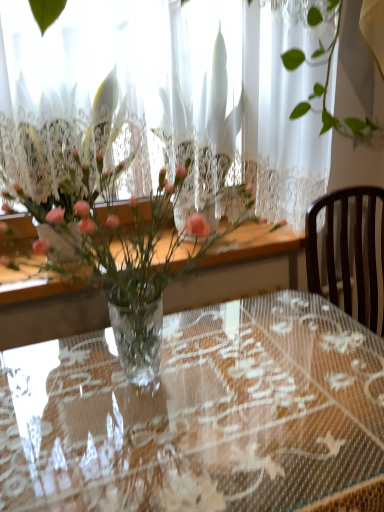
Question: Is translucent glass vase at center smaller than transparent lace tablecloth at center?

Choices:
 (A) no
 (B) yes

Answer: (B)

Question: Is translucent glass vase at center wider than transparent lace tablecloth at center?

Choices:
 (A) yes
 (B) no

Answer: (B)

Question: From the image's perspective, is translucent glass vase at center above transparent lace tablecloth at center?

Choices:
 (A) no
 (B) yes

Answer: (B)

Question: Considering the relative sizes of translucent glass vase at center and transparent lace tablecloth at center in the image provided, is translucent glass vase at center thinner than transparent lace tablecloth at center?

Choices:
 (A) yes
 (B) no

Answer: (A)

Question: Is translucent glass vase at center not within transparent lace tablecloth at center?

Choices:
 (A) yes
 (B) no

Answer: (A)

Question: From a real-world perspective, is translucent glass vase at center beneath transparent lace tablecloth at center?

Choices:
 (A) no
 (B) yes

Answer: (A)

Question: Does transparent lace tablecloth at center come behind translucent glass vase at center?

Choices:
 (A) yes
 (B) no

Answer: (B)

Question: Would you say transparent lace tablecloth at center is a long distance from translucent glass vase at center?

Choices:
 (A) yes
 (B) no

Answer: (B)

Question: Is transparent lace tablecloth at center wider than translucent glass vase at center?

Choices:
 (A) no
 (B) yes

Answer: (B)

Question: From the image's perspective, is transparent lace tablecloth at center beneath translucent glass vase at center?

Choices:
 (A) yes
 (B) no

Answer: (A)

Question: Considering the relative sizes of transparent lace tablecloth at center and translucent glass vase at center in the image provided, is transparent lace tablecloth at center taller than translucent glass vase at center?

Choices:
 (A) no
 (B) yes

Answer: (B)

Question: Is translucent glass vase at center completely or partially inside transparent lace tablecloth at center?

Choices:
 (A) no
 (B) yes

Answer: (A)

Question: From the image's perspective, is translucent glass vase at center located above or below transparent lace tablecloth at center?

Choices:
 (A) below
 (B) above

Answer: (B)